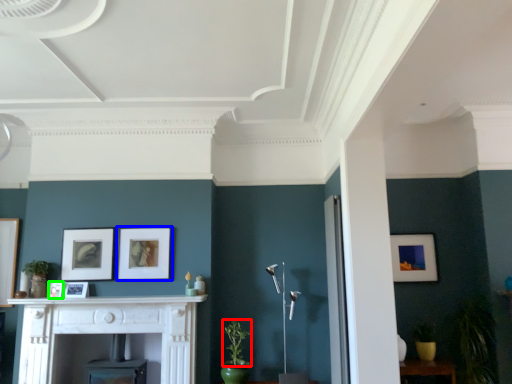
Question: Which object is the closest to the plant (highlighted by a red box)? Choose among these: picture frame (highlighted by a blue box) or picture frame (highlighted by a green box).

Choices:
 (A) picture frame
 (B) picture frame

Answer: (A)